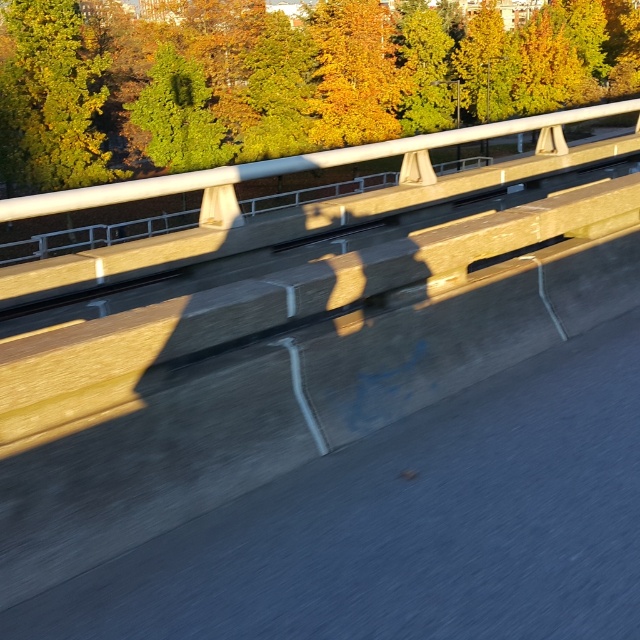
Does green leafy tree at upper center have a lesser height compared to green leafy tree at upper left?

In fact, green leafy tree at upper center may be taller than green leafy tree at upper left.

Which is more to the right, green leafy tree at upper center or green leafy tree at upper left?

green leafy tree at upper center

This screenshot has width=640, height=640. What do you see at coordinates (316, 81) in the screenshot?
I see `green leafy tree at upper center` at bounding box center [316, 81].

Find the location of a particular element. This screenshot has width=640, height=640. green leafy tree at upper center is located at coordinates (316, 81).